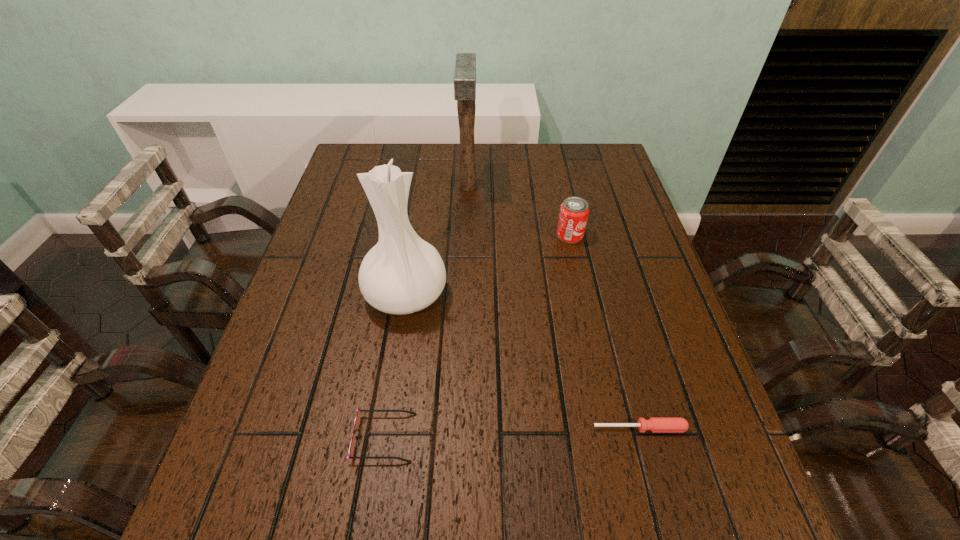
At what (x,y) coordinates should I click in order to perform the action: click on empty location between the screwdriver and the mallet. Please return your answer as a coordinate pair (x, y). Looking at the image, I should click on (554, 307).

The height and width of the screenshot is (540, 960). Identify the location of vacant space that is in between the second farthest object and the screwdriver. (605, 332).

At what (x,y) coordinates should I click in order to perform the action: click on free space between the second farthest object and the mallet. Please return your answer as a coordinate pair (x, y). Image resolution: width=960 pixels, height=540 pixels. Looking at the image, I should click on (519, 211).

Identify the location of vacant area that lies between the can and the sunglasses. (477, 336).

Where is `free area in between the sunglasses and the second farthest object`? This screenshot has height=540, width=960. free area in between the sunglasses and the second farthest object is located at coordinates (477, 336).

The height and width of the screenshot is (540, 960). Identify the location of unoccupied position between the mallet and the can. (519, 211).

Find the location of a particular element. This screenshot has height=540, width=960. vacant area that lies between the sunglasses and the shortest object is located at coordinates pyautogui.click(x=512, y=433).

You are a GUI agent. You are given a task and a screenshot of the screen. Output one action in this format:
    pyautogui.click(x=<x>, y=<y>)
    Task: Click on the free point between the screwdriver and the vase
    
    Given the screenshot: What is the action you would take?
    pyautogui.click(x=523, y=361)

Locate an element on the screen. free area in between the farthest object and the shortest object is located at coordinates (554, 307).

The image size is (960, 540). What are the coordinates of `blank region between the sunglasses and the third tallest object` in the screenshot? It's located at (477, 336).